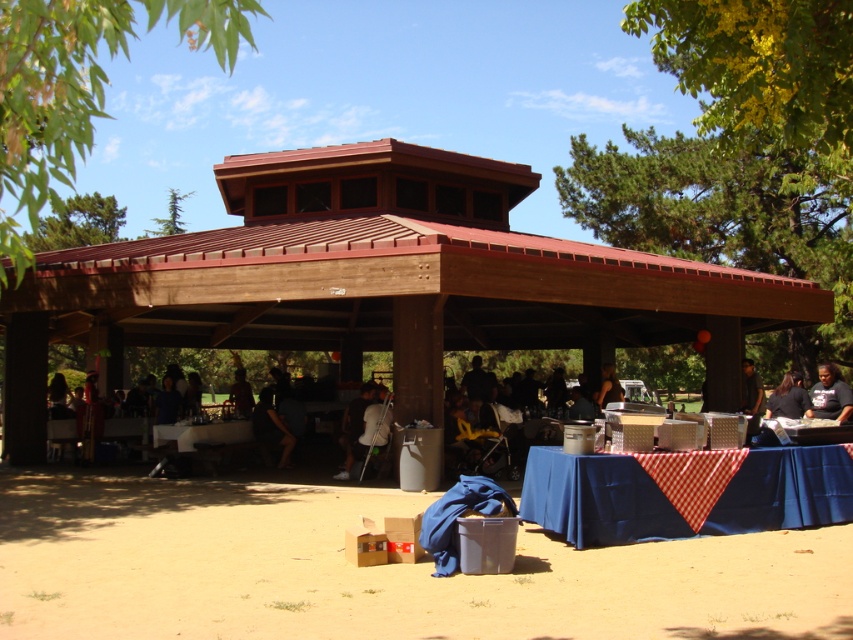
From the picture: You are standing at the center of the wooden pavilion and looking towards the upper left corner. Which object is located at the coordinates point [77,88]?

The point [77,88] indicates the location of the green leafy tree at upper left.

You are standing at the entrance of the pavilion and want to sit down. You see the dark brown hair at center and the dark gray fabric chair at center. Which object is closer to you?

The dark brown hair at center is closer to you because the dark gray fabric chair at center is behind it.

You are standing at the edge of the sandy area under the pavilion and want to take a photo of the white plastic table at center. Which direction should you face to ensure the green coniferous tree at upper left is visible in the background?

You should face the direction where the green coniferous tree at upper left is located because the white plastic table at center is below it, so the tree will naturally appear in the background when photographing the table.